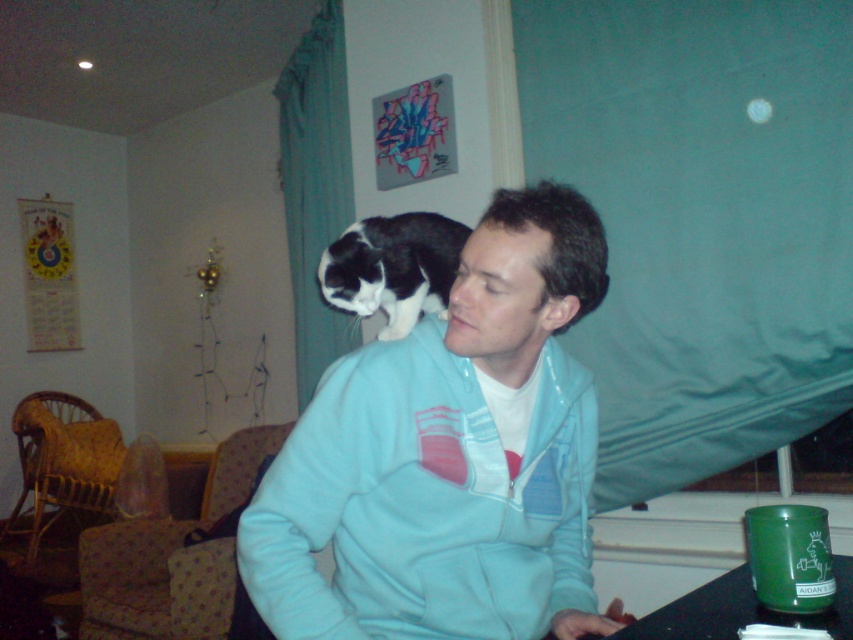
You are organizing a photo shoot and need to place a small accessory on the matte blue sweatshirt at center and the black and white fur cat on shoulder. To ensure the accessory is visible, you want to place it on the side of each object that faces away from the other. Which side should you choose for each?

For the matte blue sweatshirt at center, place the accessory on the left side since it is to the right of the black and white fur cat on shoulder. For the black and white fur cat on shoulder, place it on the right side as it faces away from the sweatshirt.

You are trying to locate the matte blue sweatshirt at center in the image. According to the coordinates provided, where exactly is it positioned?

The matte blue sweatshirt at center is located at coordinates point (x=525, y=275).

You are a photographer wanting to take a close up of the light blue fleece at center. The camera you are holding is 98.47 centimeters away from the fleece. Is the distance sufficient for a clear photo?

The light blue fleece at center and camera are 98.47 centimeters apart, so the distance is sufficient for a clear photo.